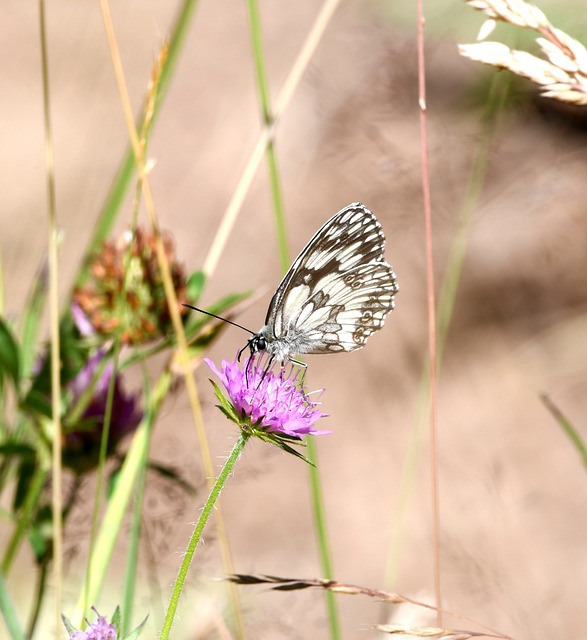
In order to click on green plant stem in this screenshot , I will do `click(236, 467)`.